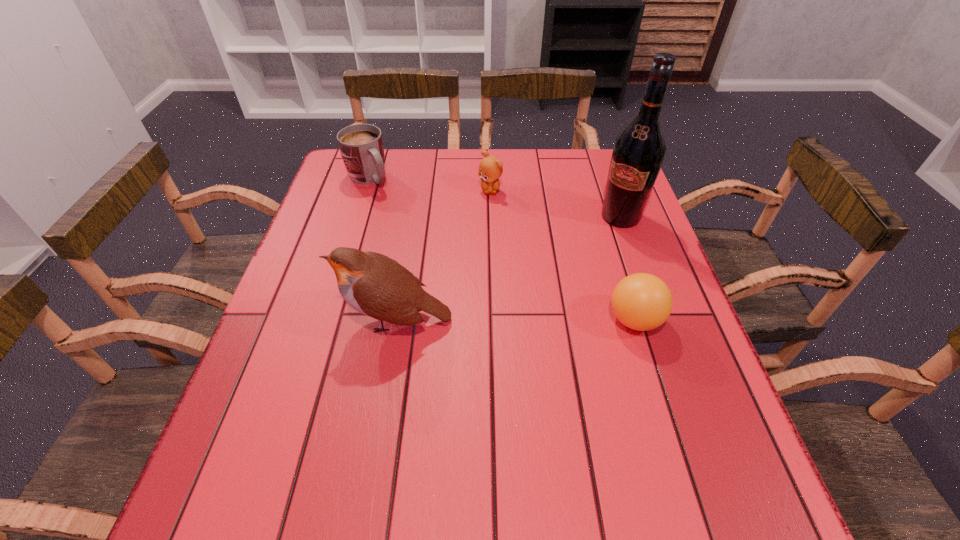
Locate an element on the screen. Image resolution: width=960 pixels, height=540 pixels. unoccupied position between the tallest object and the mug is located at coordinates (494, 198).

Where is `empty space between the ping-pong ball and the fourth shortest object`? Image resolution: width=960 pixels, height=540 pixels. empty space between the ping-pong ball and the fourth shortest object is located at coordinates coord(516,320).

At what (x,y) coordinates should I click in order to perform the action: click on vacant space that is in between the mug and the fourth shortest object. Please return your answer as a coordinate pair (x, y). The height and width of the screenshot is (540, 960). Looking at the image, I should click on (382, 249).

Locate an element on the screen. The width and height of the screenshot is (960, 540). free spot between the ping-pong ball and the tallest object is located at coordinates (628, 268).

In order to click on free space between the third object from right to left and the ping-pong ball in this screenshot , I will do `click(563, 255)`.

Where is `free space that is in between the ping-pong ball and the wine bottle`? free space that is in between the ping-pong ball and the wine bottle is located at coordinates (628, 268).

Where is `free space between the mug and the ping-pong ball`? This screenshot has height=540, width=960. free space between the mug and the ping-pong ball is located at coordinates (502, 249).

The width and height of the screenshot is (960, 540). I want to click on free space between the fourth shortest object and the third farthest object, so click(508, 268).

You are a GUI agent. You are given a task and a screenshot of the screen. Output one action in this format:
    pyautogui.click(x=<x>, y=<y>)
    Task: Click on the vacant area that lies between the bird and the third object from right to left
    
    Given the screenshot: What is the action you would take?
    pyautogui.click(x=443, y=255)

Identify the location of object that can be found as the second closest to the bird. (490, 168).